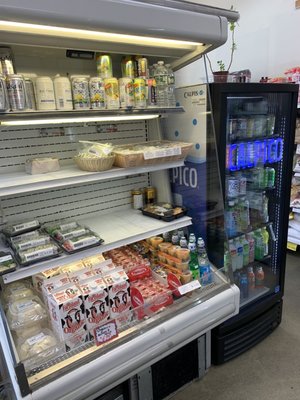
Image resolution: width=300 pixels, height=400 pixels. What are the coordinates of `light brown whicker basket` in the screenshot? It's located at (99, 161).